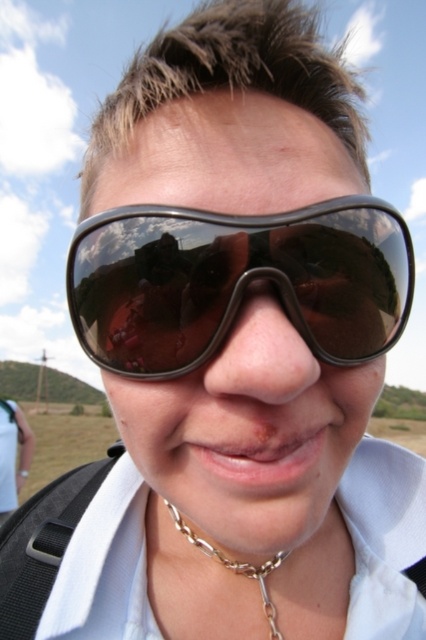
You are taking a photo of the person in the scene. You want to focus on the point at position point (259, 278) and point (267, 609). Which point should you adjust your focus to first to ensure both points are in focus?

You should focus on point (259, 278) first because it is closer to the camera than point (267, 609). By focusing on the closer point, the farther point will also be in focus due to the depth of field.

You are trying to determine if the black matte goggles at center can be placed on top of the gold chain necklace at lower center without overlapping. Given their sizes, is this possible?

The black matte goggles at center has a larger width than the gold chain necklace at lower center, so placing the goggles on top would likely cause overlapping since the necklace is narrower.

You are a photographer trying to capture a clear image of the black matte goggles at center. Considering the distance between the goggles and the camera, is it within the typical focus range of a standard DSLR camera?

The black matte goggles at center is 11.98 inches from the camera. A standard DSLR camera typically has a minimum focusing distance of around 12 inches, so the goggles are just slightly too close to be in focus without using specialized equipment.